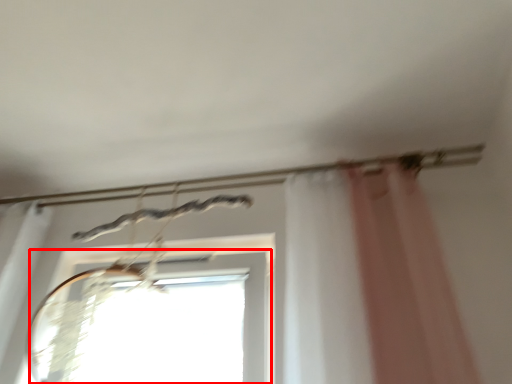
Question: From the image's perspective, what is the correct spatial positioning of window (annotated by the red box) in reference to clothesline?

Choices:
 (A) below
 (B) above

Answer: (A)